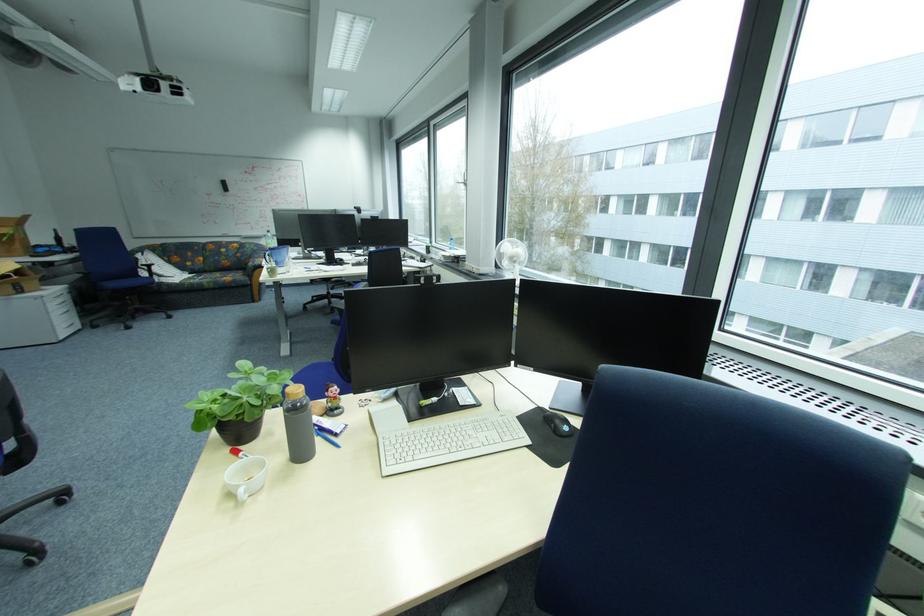
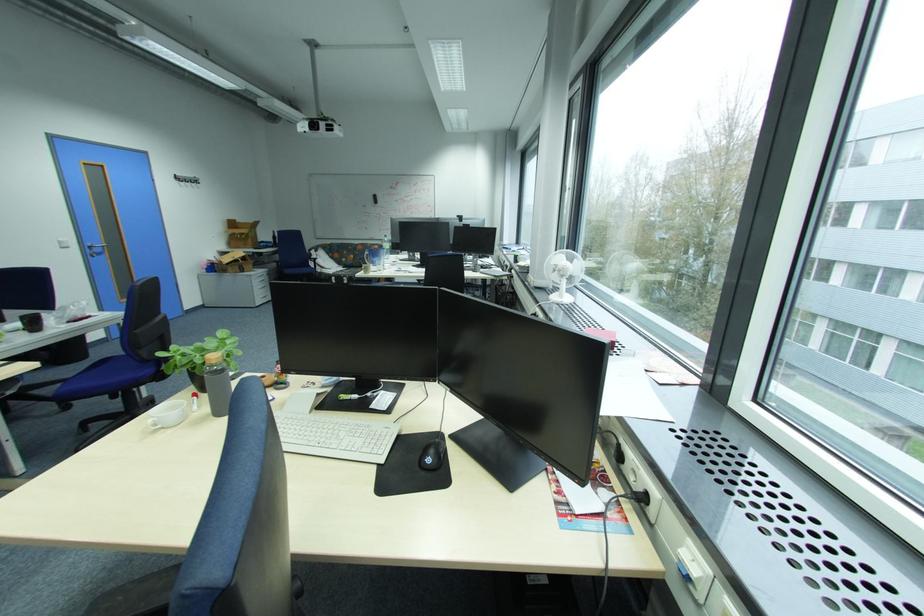
Question: The camera is either moving clockwise (left) or counter-clockwise (right) around the object. The first image is from the beginning of the video and the second image is from the end. Is the camera moving left or right when shooting the video?

Choices:
 (A) Left
 (B) Right

Answer: (B)